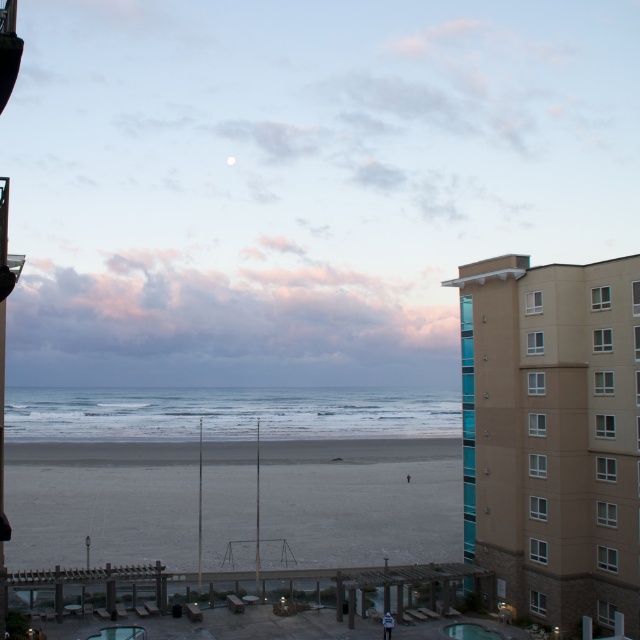
Question: Does beige concrete building at right come behind gray sand at center?

Choices:
 (A) no
 (B) yes

Answer: (A)

Question: Is beige concrete building at right positioned at the back of smooth concrete pool at center?

Choices:
 (A) no
 (B) yes

Answer: (A)

Question: Which of the following is the closest to the observer?

Choices:
 (A) transparent glass pool at lower center
 (B) gray sand at center
 (C) beige concrete building at right
 (D) smooth concrete pool at center

Answer: (C)

Question: Among these objects, which one is nearest to the camera?

Choices:
 (A) beige concrete building at right
 (B) gray sand at center
 (C) matte blue sky at upper center
 (D) transparent glass pool at lower center

Answer: (A)

Question: Among these objects, which one is nearest to the camera?

Choices:
 (A) gray sand at center
 (B) beige concrete building at right
 (C) smooth concrete pool at center
 (D) matte blue sky at upper center

Answer: (B)

Question: From the image, what is the correct spatial relationship of smooth concrete pool at center in relation to transparent glass pool at lower center?

Choices:
 (A) left
 (B) right

Answer: (B)